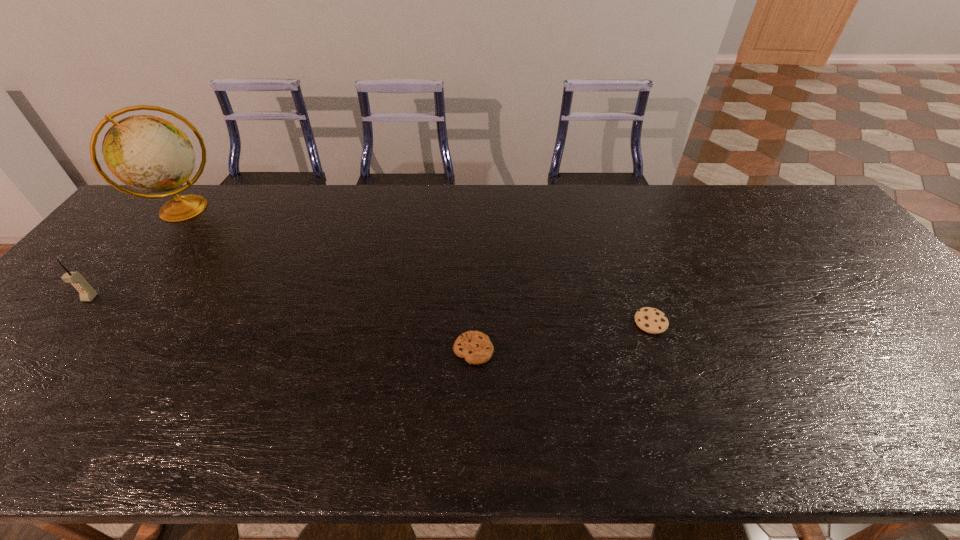
At what (x,y) coordinates should I click in order to perform the action: click on the tallest object. Please return your answer as a coordinate pair (x, y). This screenshot has height=540, width=960. Looking at the image, I should click on (150, 154).

Locate an element on the screen. globe is located at coordinates [x=150, y=154].

At what (x,y) coordinates should I click in order to perform the action: click on the second farthest object. Please return your answer as a coordinate pair (x, y). The image size is (960, 540). Looking at the image, I should click on (86, 292).

Where is `cellular telephone`? This screenshot has width=960, height=540. cellular telephone is located at coordinates (86, 292).

The image size is (960, 540). Identify the location of the rightmost object. (651, 320).

The height and width of the screenshot is (540, 960). I want to click on the second object from right to left, so click(476, 347).

The height and width of the screenshot is (540, 960). Find the location of `vacant space located on the right of the globe`. vacant space located on the right of the globe is located at coordinates (252, 209).

Identify the location of free spot located 0.160m on the front of the third shortest object, where the keypad is located. The height and width of the screenshot is (540, 960). (43, 353).

The width and height of the screenshot is (960, 540). I want to click on vacant space positioned on the right of the right cookie, so click(x=695, y=322).

Locate an element on the screen. Image resolution: width=960 pixels, height=540 pixels. free space located 0.230m on the left of the second object from right to left is located at coordinates (356, 350).